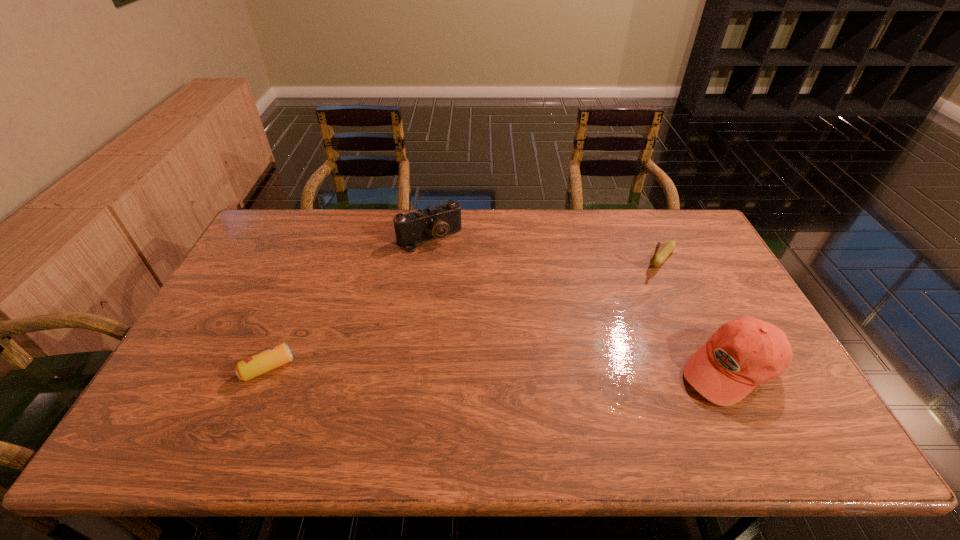
The height and width of the screenshot is (540, 960). What are the coordinates of `vacant spot on the desktop that is between the beer can and the baseball cap and is positioned on the front-facing side of the third object from right to left` in the screenshot? It's located at (511, 368).

The width and height of the screenshot is (960, 540). Find the location of `vacant space on the desktop that is between the shortest object and the baseball cap and is positioned at the stem of the banana`. vacant space on the desktop that is between the shortest object and the baseball cap and is positioned at the stem of the banana is located at coordinates pos(562,368).